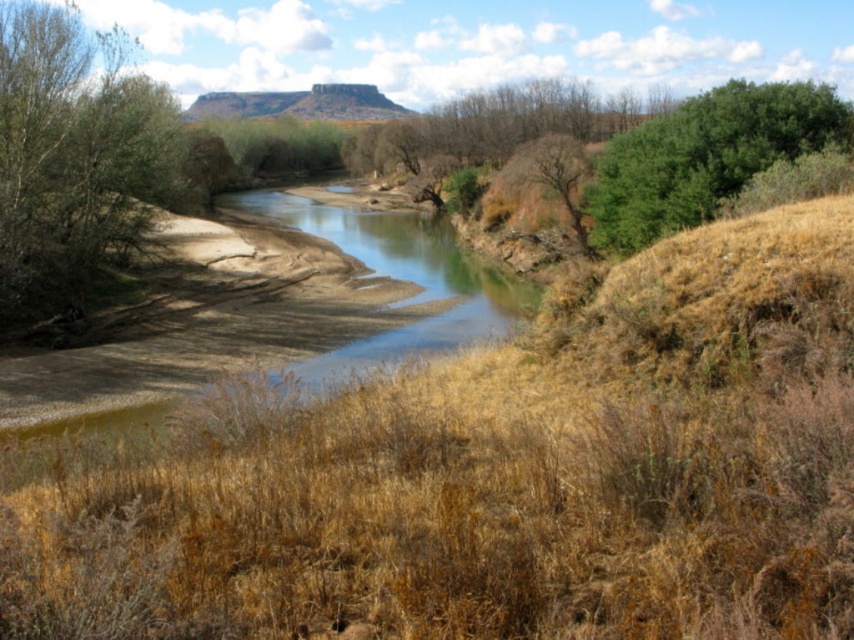
Can you confirm if brown dry grass at center is smaller than green leafy tree at left?

Indeed, brown dry grass at center has a smaller size compared to green leafy tree at left.

Between brown dry grass at center and green leafy tree at left, which one has less height?

With less height is brown dry grass at center.

Image resolution: width=854 pixels, height=640 pixels. I want to click on brown dry grass at center, so click(x=493, y=476).

What are the coordinates of `brown dry grass at center` in the screenshot? It's located at (493, 476).

Locate an element on the screen. Image resolution: width=854 pixels, height=640 pixels. green leafy tree at left is located at coordinates (74, 157).

Identify the location of green leafy tree at left. The height and width of the screenshot is (640, 854). (74, 157).

Does brown dry grass at center appear on the right side of green leafy tree at upper right?

Incorrect, brown dry grass at center is not on the right side of green leafy tree at upper right.

Which is below, brown dry grass at center or green leafy tree at upper right?

brown dry grass at center is lower down.

Image resolution: width=854 pixels, height=640 pixels. I want to click on brown dry grass at center, so click(493, 476).